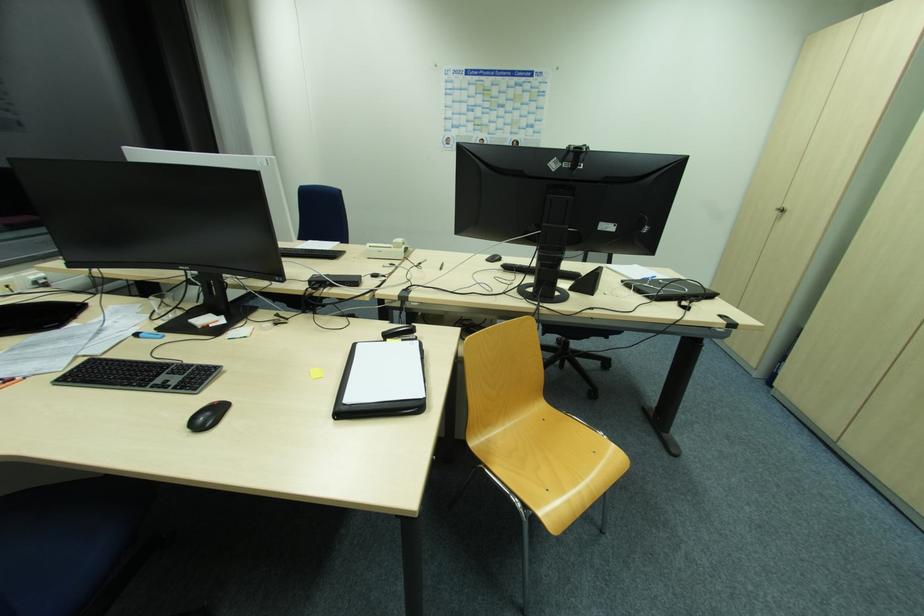
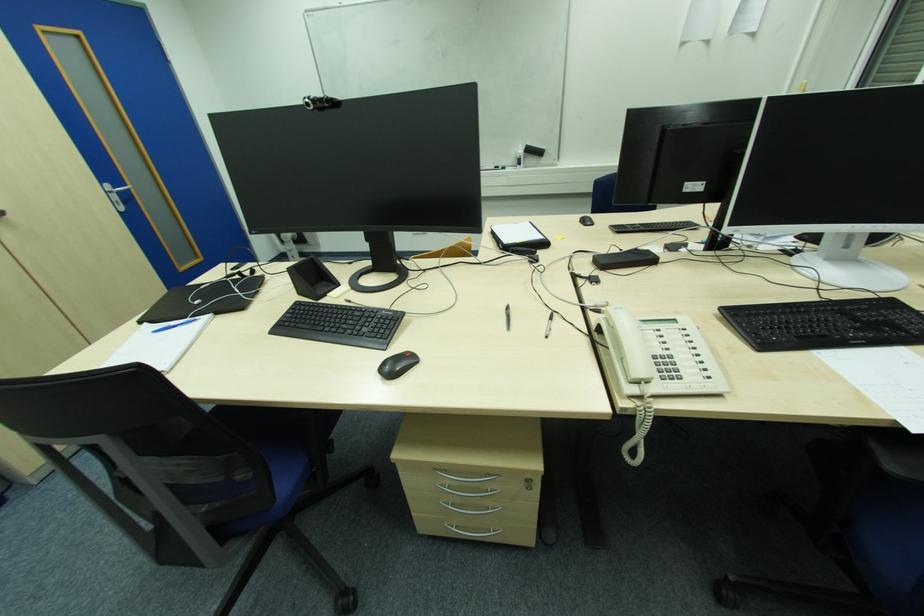
Find the pixel in the second image that matches [658,278] in the first image.

(156, 333)